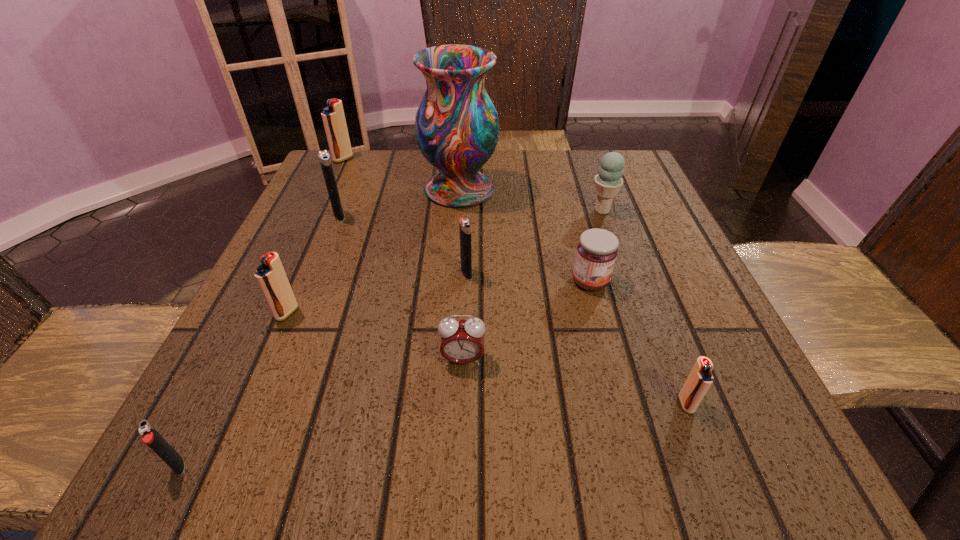
The image size is (960, 540). Find the location of `vacant region that satisfies the following two spatial constraints: 1. on the front side of the tallest object; 2. on the left side of the rightmost red igniter`. vacant region that satisfies the following two spatial constraints: 1. on the front side of the tallest object; 2. on the left side of the rightmost red igniter is located at coordinates (445, 404).

Where is `free spot that satisfies the following two spatial constraints: 1. on the back side of the farthest red igniter; 2. on the left side of the nearest object`? free spot that satisfies the following two spatial constraints: 1. on the back side of the farthest red igniter; 2. on the left side of the nearest object is located at coordinates (332, 159).

You are a GUI agent. You are given a task and a screenshot of the screen. Output one action in this format:
    pyautogui.click(x=<x>, y=<y>)
    Task: Click on the vacant space that satisfies the following two spatial constraints: 1. on the clock face of the alarm clock; 2. on the left side of the smallest red igniter
    
    Given the screenshot: What is the action you would take?
    pyautogui.click(x=461, y=404)